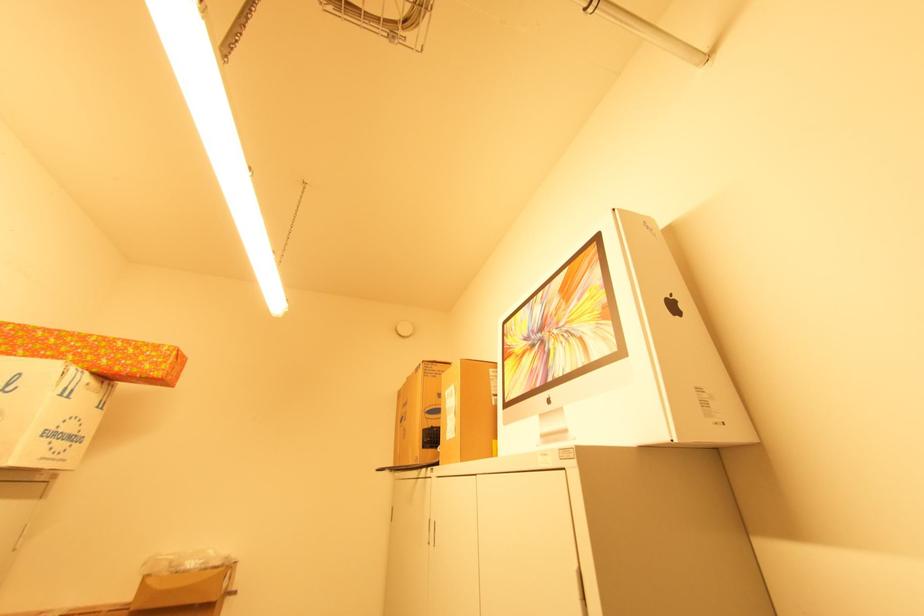
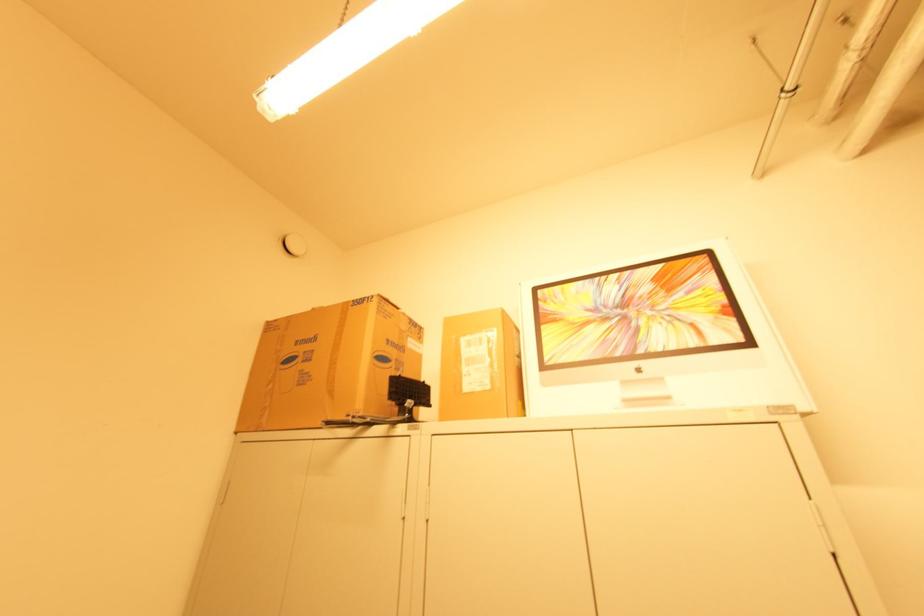
In the second image, find the point that corresponds to [495,398] in the first image.

(520, 359)